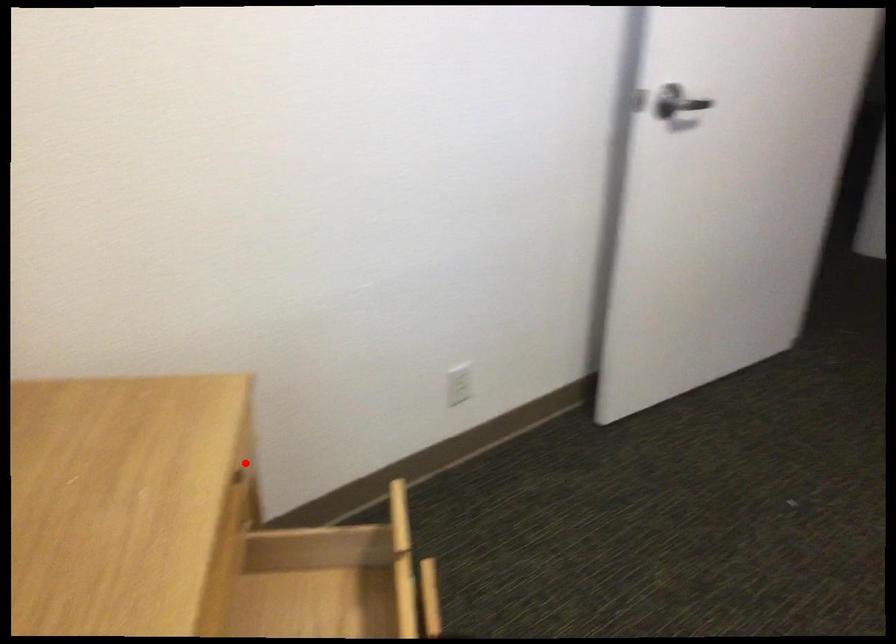
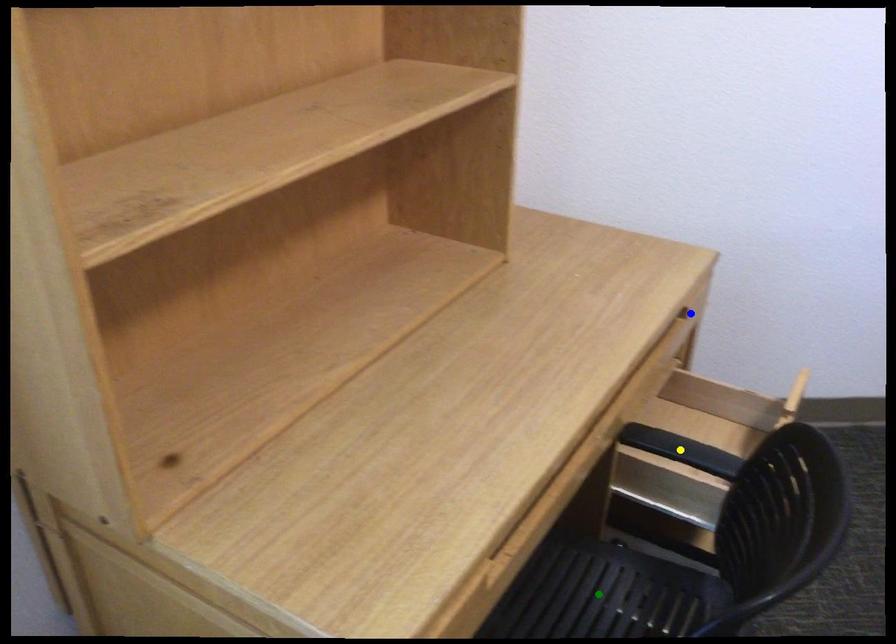
Question: I am providing you with two images of the same scene from different viewpoints. A red point is marked on the first image. You are given multiple points on the second image. Which spot in image 2 lines up with the point in image 1?

Choices:
 (A) green point
 (B) yellow point
 (C) blue point

Answer: (C)